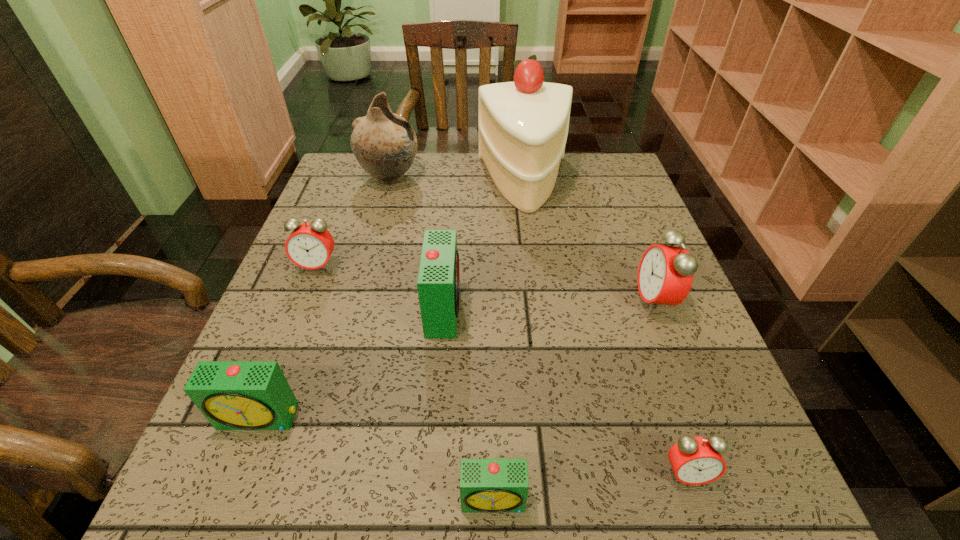
The height and width of the screenshot is (540, 960). What are the coordinates of `green alarm clock that stands as the closest to the smallest green alarm clock` in the screenshot? It's located at (438, 283).

Where is `free region that satisfies the following two spatial constraints: 1. on the front-facing side of the farthest green alarm clock; 2. on the front-facing side of the leftmost green alarm clock`? free region that satisfies the following two spatial constraints: 1. on the front-facing side of the farthest green alarm clock; 2. on the front-facing side of the leftmost green alarm clock is located at coordinates (435, 417).

Image resolution: width=960 pixels, height=540 pixels. Find the location of `free spot that satisfies the following two spatial constraints: 1. on the front-facing side of the second nearest red alarm clock; 2. on the front-facing side of the smallest red alarm clock`. free spot that satisfies the following two spatial constraints: 1. on the front-facing side of the second nearest red alarm clock; 2. on the front-facing side of the smallest red alarm clock is located at coordinates (721, 474).

At what (x,y) coordinates should I click in order to perform the action: click on free location that satisfies the following two spatial constraints: 1. on the front-facing side of the biggest red alarm clock; 2. on the front-facing side of the second biggest green alarm clock. Please return your answer as a coordinate pair (x, y). This screenshot has width=960, height=540. Looking at the image, I should click on (699, 417).

At what (x,y) coordinates should I click in order to perform the action: click on free space that satisfies the following two spatial constraints: 1. from the spout of the seventh shortest object; 2. on the front-facing side of the second farthest green alarm clock. Please return your answer as a coordinate pair (x, y). Looking at the image, I should click on (324, 417).